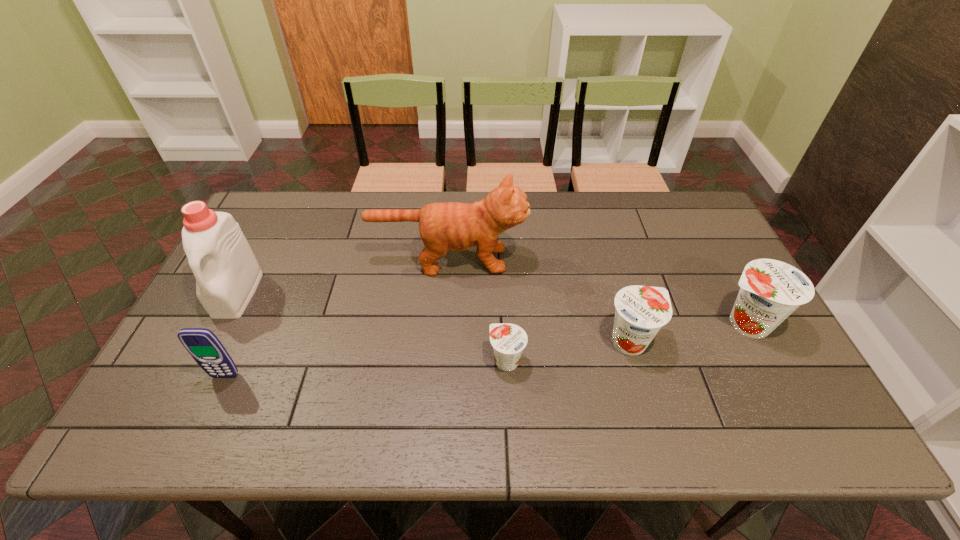
Identify the location of free location that satisfies the following two spatial constraints: 1. on the face of the cat; 2. on the handle side of the detergent. The width and height of the screenshot is (960, 540). (446, 294).

Locate an element on the screen. vacant region that satisfies the following two spatial constraints: 1. on the back side of the shortest object; 2. on the left side of the rightmost yogurt is located at coordinates (505, 323).

Locate an element on the screen. The image size is (960, 540). free region that satisfies the following two spatial constraints: 1. on the face of the cat; 2. on the left side of the fifth object from left to right is located at coordinates (443, 341).

I want to click on blank space that satisfies the following two spatial constraints: 1. on the face of the shortest object; 2. on the left side of the cat, so click(441, 361).

Identify the location of vacant region that satisfies the following two spatial constraints: 1. on the face of the cat; 2. on the back side of the shortest yogurt. Image resolution: width=960 pixels, height=540 pixels. (441, 361).

Where is `vacant space that satisfies the following two spatial constraints: 1. on the handle side of the detergent; 2. on the left side of the second object from right to left`? This screenshot has width=960, height=540. vacant space that satisfies the following two spatial constraints: 1. on the handle side of the detergent; 2. on the left side of the second object from right to left is located at coordinates (213, 341).